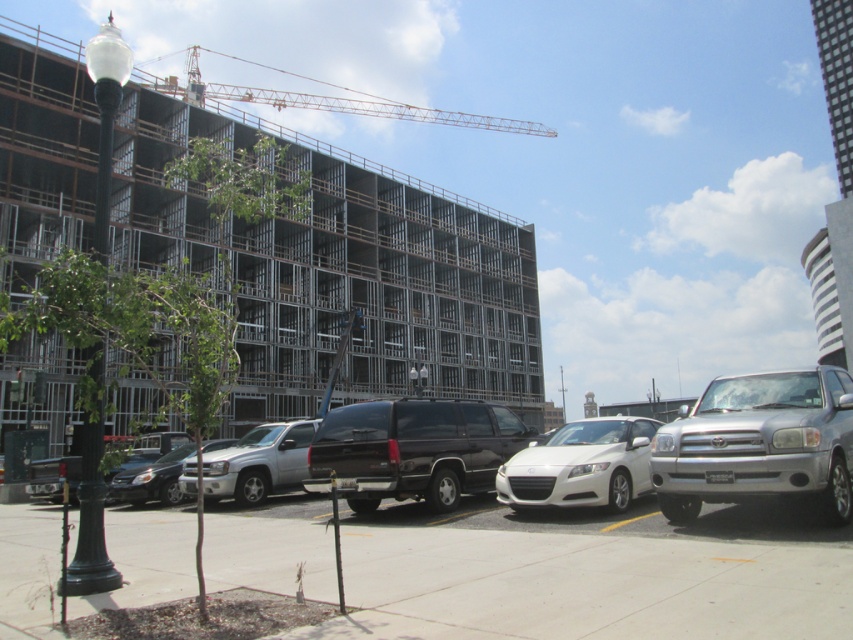
You are a delivery driver arriving at the construction site. You need to park your truck between the metal frame building at upper left and the silver metallic suv at center. Is there enough space between them for your truck?

The metal frame building at upper left is above the silver metallic suv at center, so there is vertical space between them. However, since the truck requires horizontal space, the vertical positioning does not indicate sufficient horizontal room. Check the parking lot layout for available spots.

You are a delivery driver who needs to park your truck in the parking lot. The parking lot has a metal frame building at upper left and a silver metallic suv at center. Which object is larger and might block your view when backing up?

The metal frame building at upper left is bigger than the silver metallic suv at center, so it might block your view more when backing up.